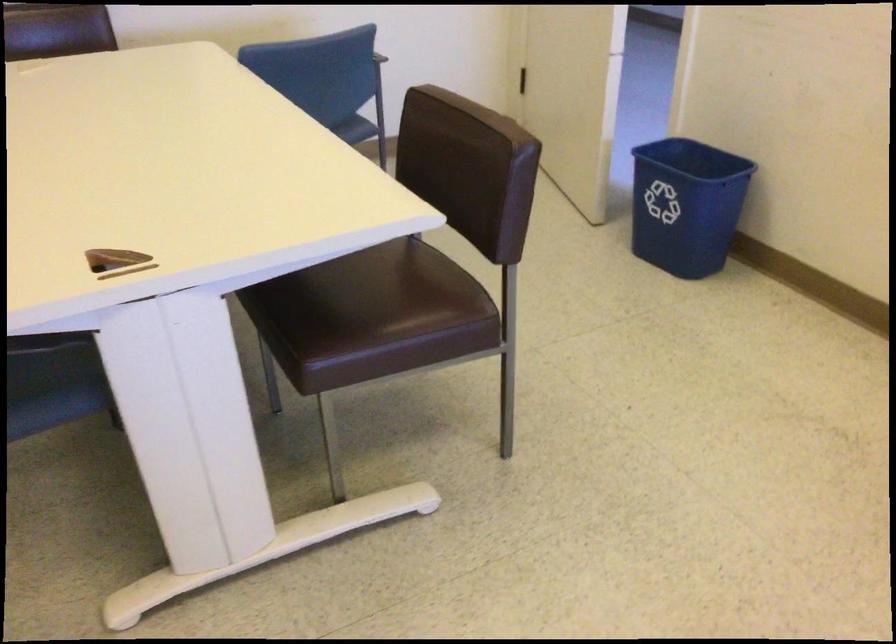
Locate an element on the screen. Image resolution: width=896 pixels, height=644 pixels. blue recycling bin is located at coordinates (686, 205).